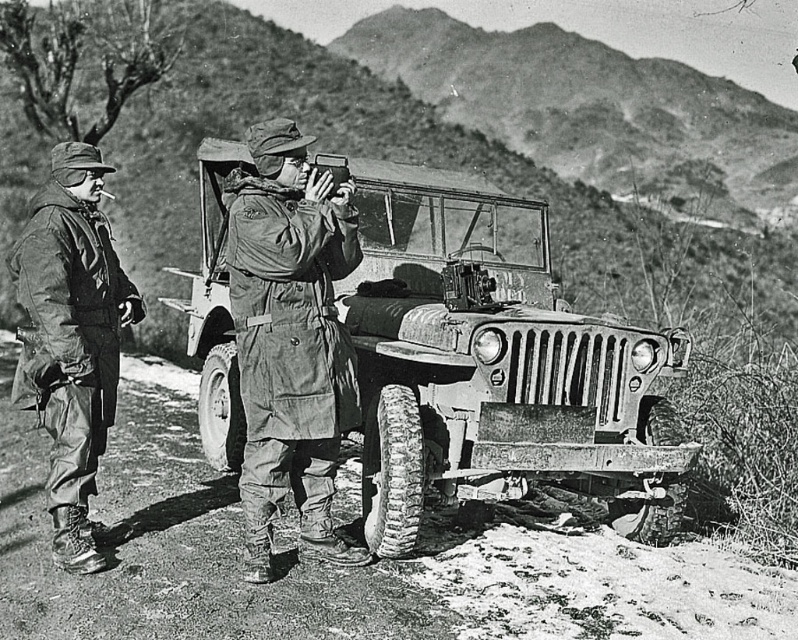
Question: Does rusty metal jeep at center appear on the right side of dull olive-green fabric at center?

Choices:
 (A) no
 (B) yes

Answer: (B)

Question: Based on their relative distances, which object is farther from the brushed metal jacket at left?

Choices:
 (A) dull olive-green fabric at center
 (B) matte black gun at center

Answer: (B)

Question: Can you confirm if brushed metal jacket at left is smaller than matte black gun at center?

Choices:
 (A) yes
 (B) no

Answer: (B)

Question: Among these objects, which one is nearest to the camera?

Choices:
 (A) matte black gun at center
 (B) brushed metal jacket at left
 (C) dull olive-green fabric at center
 (D) rusty metal jeep at center

Answer: (C)

Question: Does rusty metal jeep at center have a smaller size compared to matte black gun at center?

Choices:
 (A) no
 (B) yes

Answer: (A)

Question: Which point is closer to the camera taking this photo?

Choices:
 (A) (336, 324)
 (B) (417, 497)

Answer: (A)